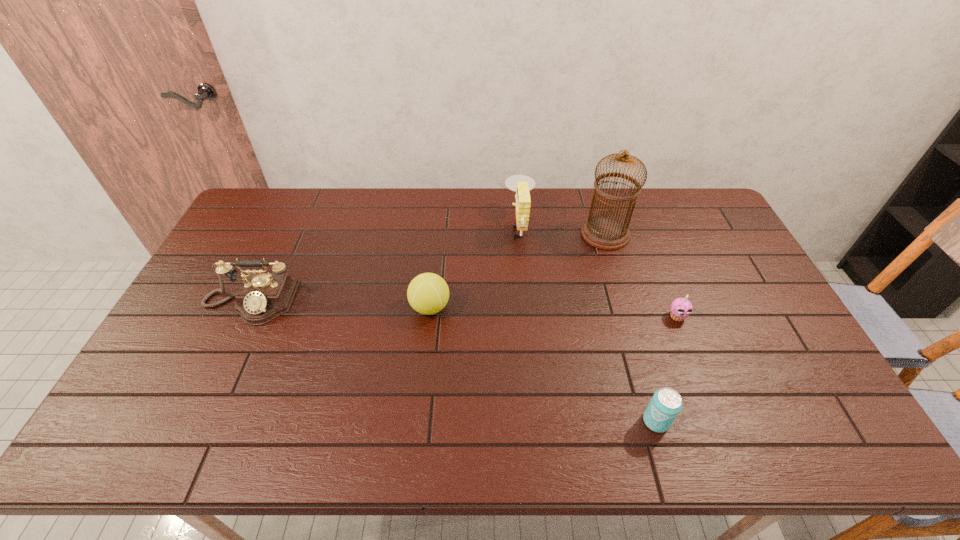
In order to click on the tallest object in this screenshot , I will do `click(605, 232)`.

What are the coordinates of `sponge` in the screenshot? It's located at (521, 184).

Locate an element on the screen. The height and width of the screenshot is (540, 960). telephone is located at coordinates (262, 297).

Find the location of `tennis ball`. tennis ball is located at coordinates (428, 293).

You are a GUI agent. You are given a task and a screenshot of the screen. Output one action in this format:
    pyautogui.click(x=<x>, y=<y>)
    Task: Click on the beer can
    The image size is (960, 540).
    Given the screenshot: What is the action you would take?
    coord(666,403)

At what (x,y) coordinates should I click in order to perform the action: click on the rightmost object. Please return your answer as a coordinate pair (x, y). Image resolution: width=960 pixels, height=540 pixels. Looking at the image, I should click on (681, 308).

This screenshot has width=960, height=540. In order to click on the shortest object in this screenshot , I will do `click(681, 308)`.

This screenshot has height=540, width=960. What are the coordinates of `blank space located on the front-facing side of the birdcage` in the screenshot? It's located at (538, 234).

Find the location of a particular element. This screenshot has height=540, width=960. vacant region located 0.320m on the front-facing side of the birdcage is located at coordinates (489, 234).

Locate an element on the screen. vacant space located 0.270m on the front-facing side of the birdcage is located at coordinates (503, 234).